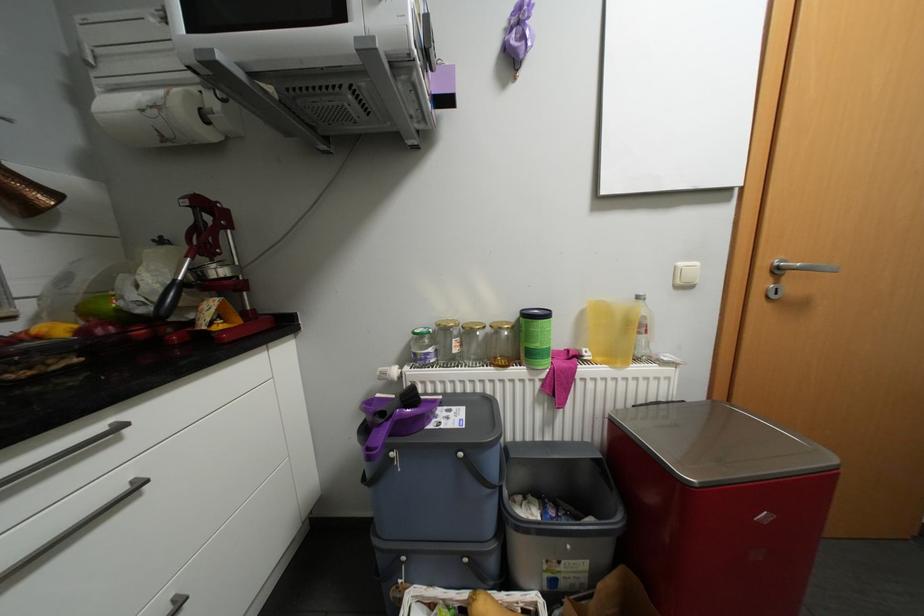
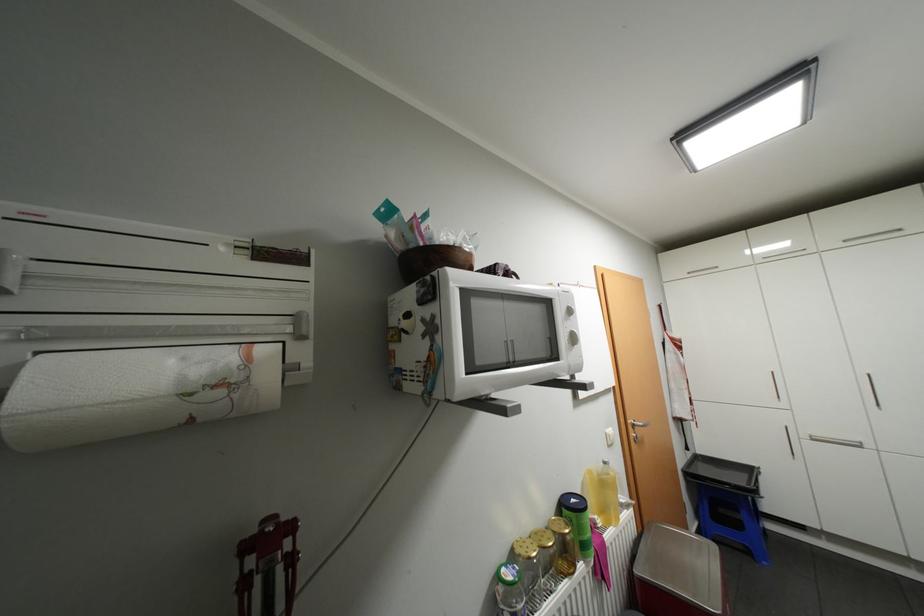
In the second image, find the point that corresponds to pixel 537 334 in the first image.

(589, 528)